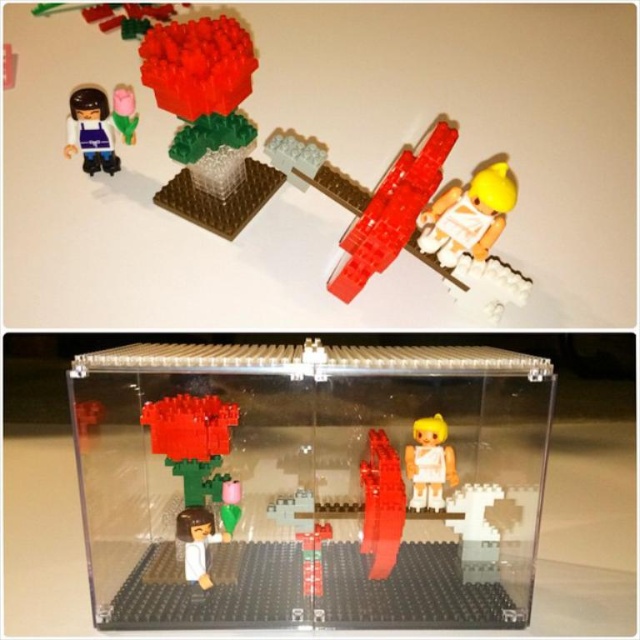
You are a LEGO enthusiast who wants to display both the matte purple plastic figure at upper left and the white glossy minifigure at lower left on a shelf. Which figure will take up more space on the shelf?

The matte purple plastic figure at upper left is larger in size than the white glossy minifigure at lower left, so it will take up more space on the shelf.

You are a gardener looking at the LEGO creations. Which of the two flowers, the translucent plastic rose at center or the matte pink flower at upper left, is taller?

The matte pink flower at upper left is taller than the translucent plastic rose at center.

You are a LEGO enthusiast examining the top section of the image. You see the matte purple plastic figure at upper left and the white glossy minifigure at lower left. Which figure is positioned higher up in this section?

The matte purple plastic figure at upper left is positioned higher up than the white glossy minifigure at lower left.